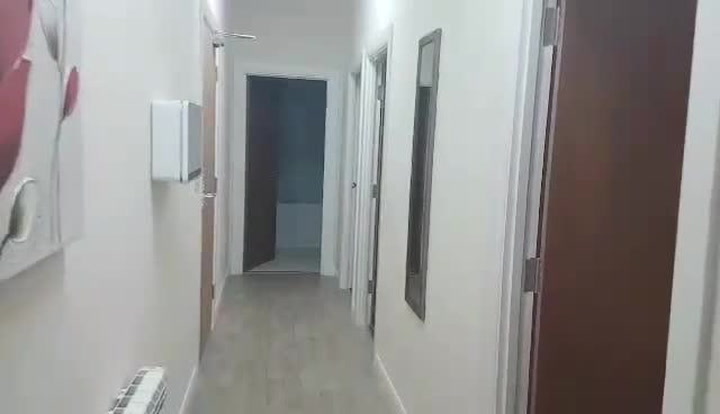
At what (x,y) coordinates should I click in order to perform the action: click on light. Please return your answer as a coordinate pair (x, y). Looking at the image, I should click on (378, 16), (206, 17).